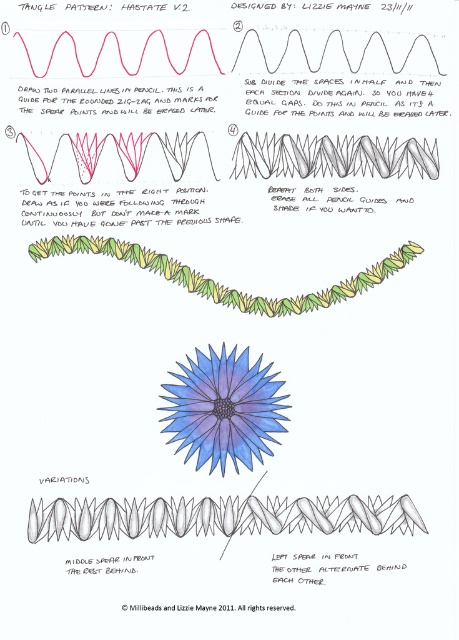
Question: Does blue matte flower at center appear on the left side of green grass-like at lower center?

Choices:
 (A) yes
 (B) no

Answer: (A)

Question: Can you confirm if gray pencil lines at lower center is thinner than green grass-like at lower center?

Choices:
 (A) no
 (B) yes

Answer: (A)

Question: Which point is closer to the camera?

Choices:
 (A) gray pencil lines at lower center
 (B) blue matte flower at center

Answer: (A)

Question: Estimate the real-world distances between objects in this image. Which object is farther from the gray pencil lines at lower center?

Choices:
 (A) blue matte flower at center
 (B) green grass-like at lower center

Answer: (B)

Question: Estimate the real-world distances between objects in this image. Which object is farther from the gray pencil lines at lower center?

Choices:
 (A) green grass-like at lower center
 (B) blue matte flower at center

Answer: (A)

Question: Is gray pencil lines at lower center bigger than green grass-like at lower center?

Choices:
 (A) yes
 (B) no

Answer: (B)